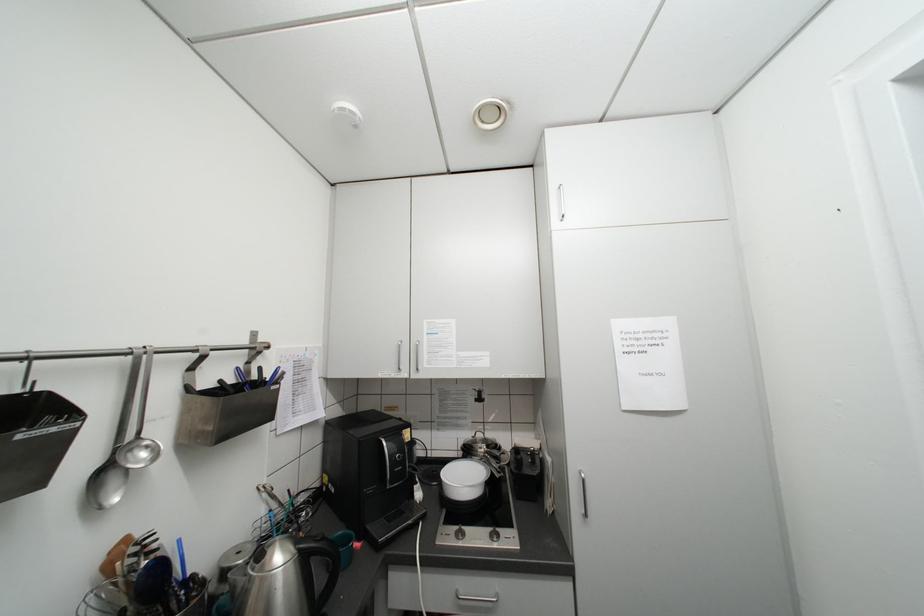
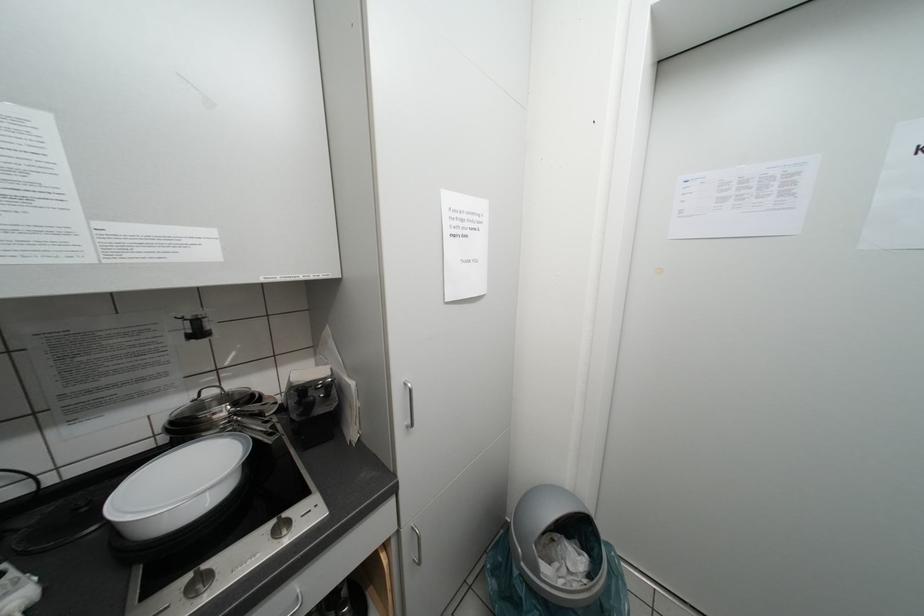
How did the camera likely rotate?

The camera's rotation is toward right-down.